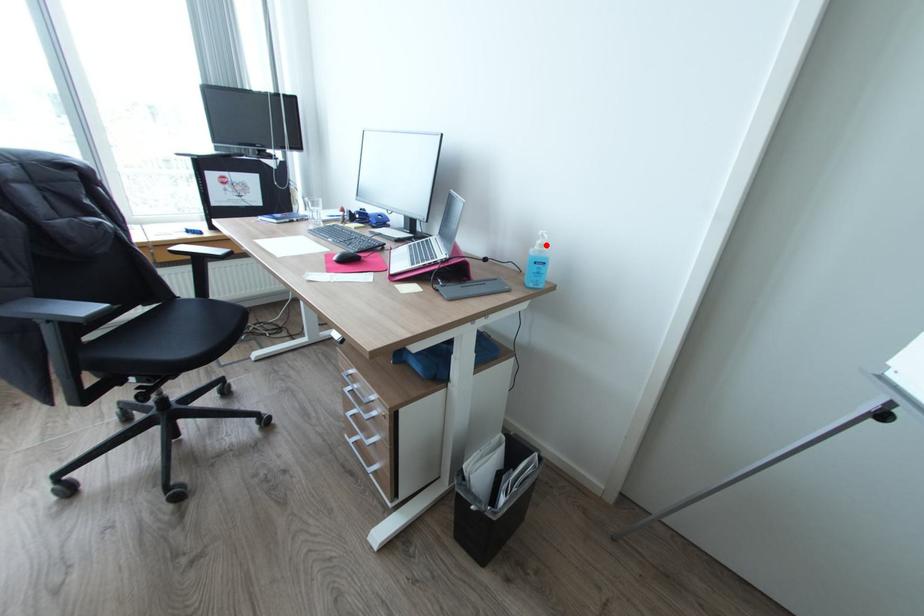
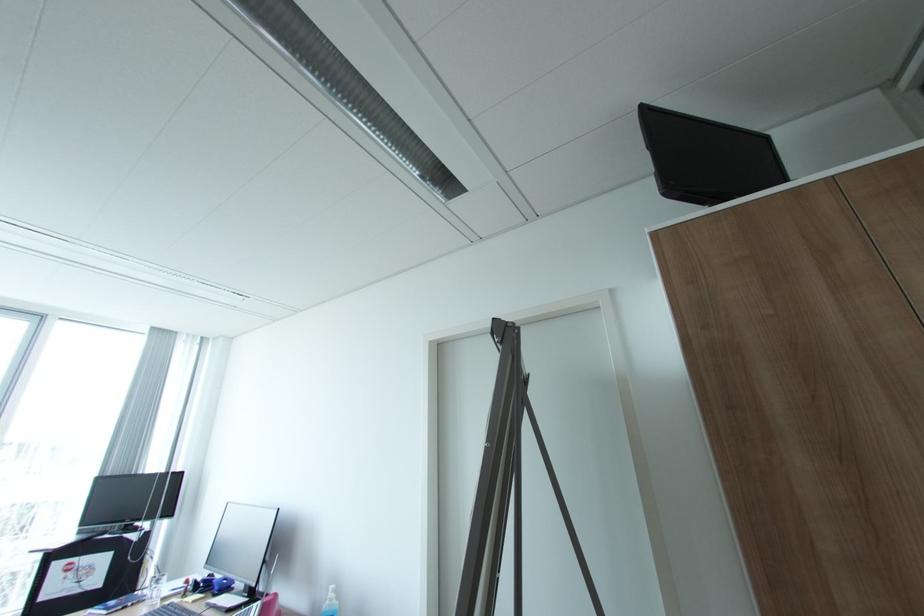
Locate, in the second image, the point that corresponds to the highlighted location in the first image.

(336, 599)